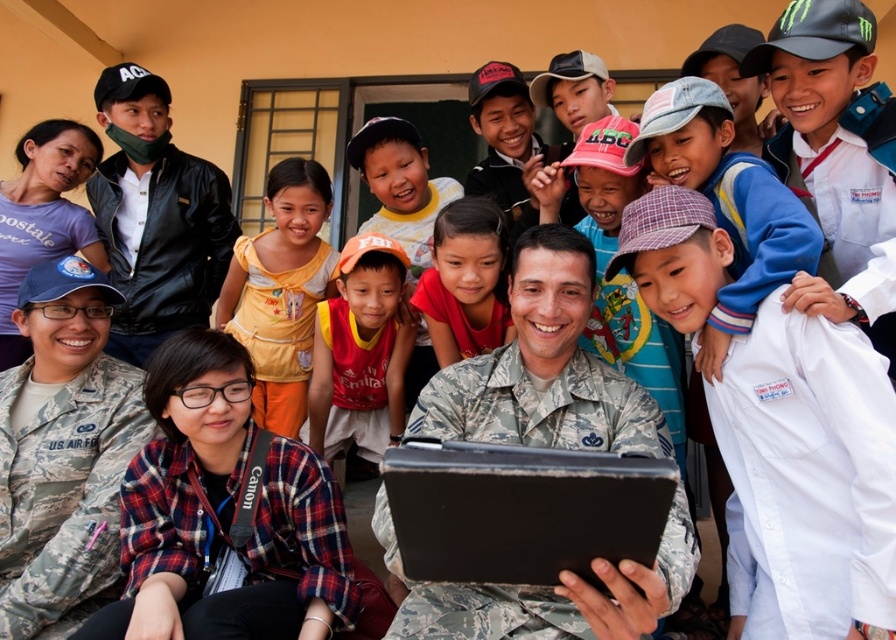
You are a photographer trying to capture a group photo of the camouflage uniform at center and the matte red shirt at center. Since you want both subjects to appear the same height in the photo, what adjustment should you make to your camera angle?

To make the camouflage uniform at center and the matte red shirt at center appear the same height in the photo, tilt the camera upwards slightly so that the shorter matte red shirt at center is framed closer to the top of the frame, while the taller camouflage uniform at center is positioned lower, balancing their apparent heights.